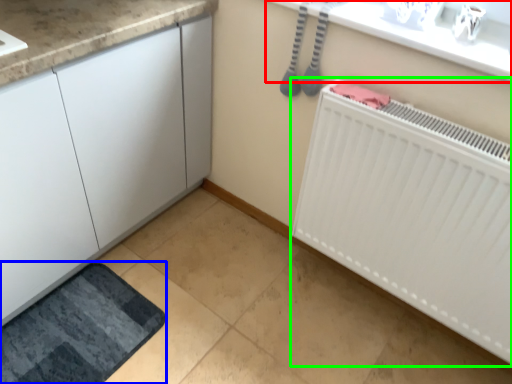
Question: Which object is the farthest from counter top (highlighted by a red box)? Choose among these: bath mat (highlighted by a blue box) or radiator (highlighted by a green box).

Choices:
 (A) bath mat
 (B) radiator

Answer: (A)